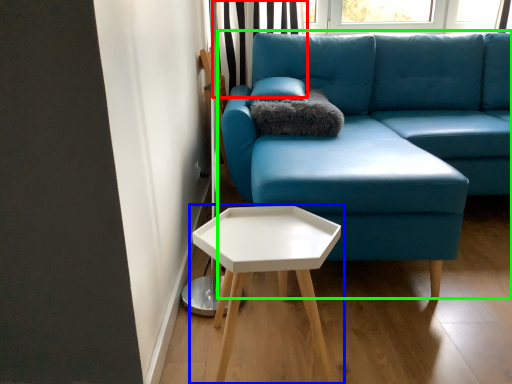
Question: Which object is positioned farthest from curtain (highlighted by a red box)? Select from table (highlighted by a blue box) and studio couch (highlighted by a green box).

Choices:
 (A) table
 (B) studio couch

Answer: (A)